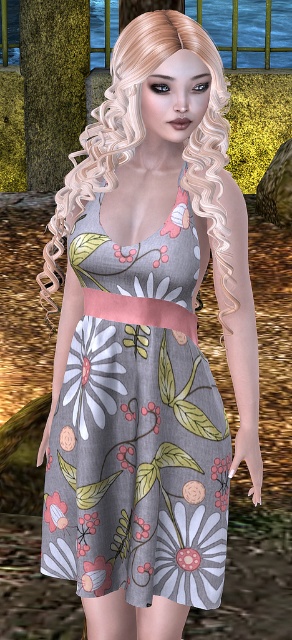
You are a photographer adjusting your camera to focus on two points in the image. The first point is point (40,276) and the second is point (53,506). Which point is closer to your camera lens?

Point (40,276) is further to the viewer than point (53,506), so the point closer to the camera lens is point (53,506).